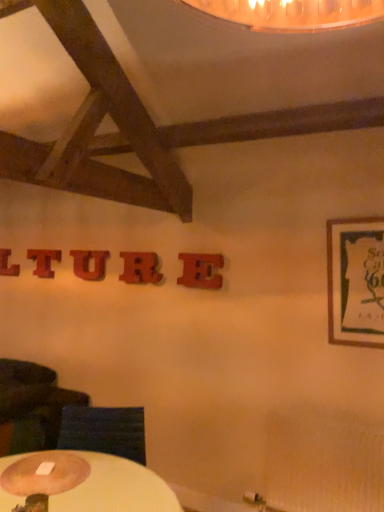
Question: Do you think wooden letter u at center, the third letter from the right, is within wooden letter at upper left, marked as the 4th letter in a right-to-left arrangement, or outside of it?

Choices:
 (A) outside
 (B) inside

Answer: (A)

Question: Is wooden letter u at center, acting as the third letter starting from the front, bigger or smaller than wooden letter at upper left, the fourth letter from the front?

Choices:
 (A) big
 (B) small

Answer: (A)

Question: Considering the real-world distances, which object is closest to the wooden framed poster at right?

Choices:
 (A) wooden round table lamp at lower left
 (B) matte wood letter e at center, which is the 5th letter in left-to-right order
 (C) wooden letter u at center, the 3th letter viewed from the back
 (D) wooden letter at center, which is the 2th letter from right to left
 (E) wooden letter at upper left, the 2th letter viewed from the back

Answer: (B)

Question: Which of these objects is positioned closest to the matte wood letter e at center, the first letter viewed from the right?

Choices:
 (A) wooden letter u at center, the 3th letter viewed from the back
 (B) wooden letter at upper left, marked as the 4th letter in a right-to-left arrangement
 (C) wooden letter at center, which is the 2th letter from right to left
 (D) wooden coaster at lower left
 (E) red wood letter at center, arranged as the 1th letter when viewed from the left

Answer: (C)